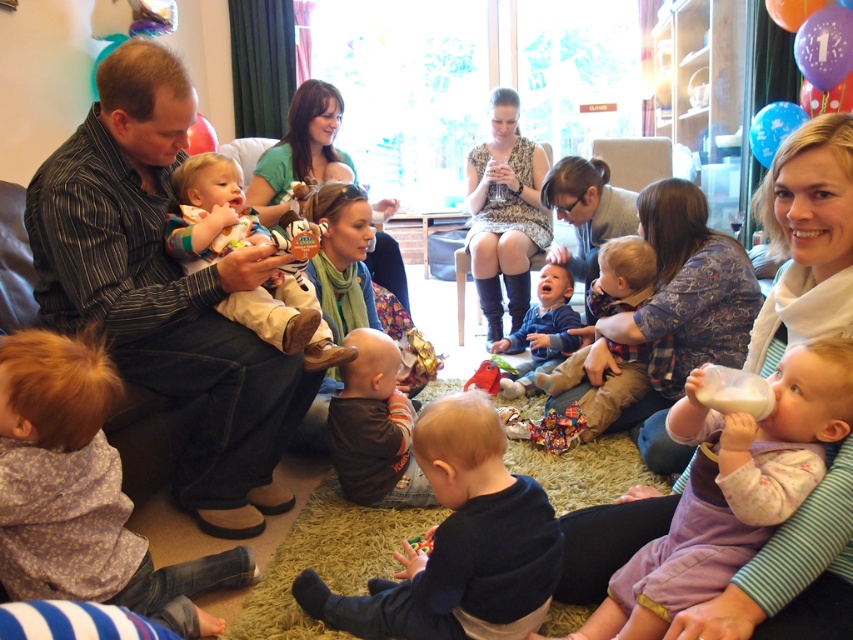
From the picture: You are standing in the living room and want to place a small decoration exactly halfway between point (30,476) and point (370,445). Considering their positions, will the decoration be closer to the viewer or further away from you?

The decoration placed halfway between point (30,476) and point (370,445) will be closer to the viewer than point (370,445) but not as close as point (30,476). Since point (30,476) is closer to the viewer, the midpoint will still be nearer than the farther point.

You are a photographer at the birthday party and need to capture a photo of the blue soft baby at center without the purple fabric bib at lower right appearing in the frame. Based on their positions, is this possible?

The purple fabric bib at lower right is located below the blue soft baby at center, so if you position the camera to focus on the upper part of the blue soft baby at center, the bib will not be in the frame.